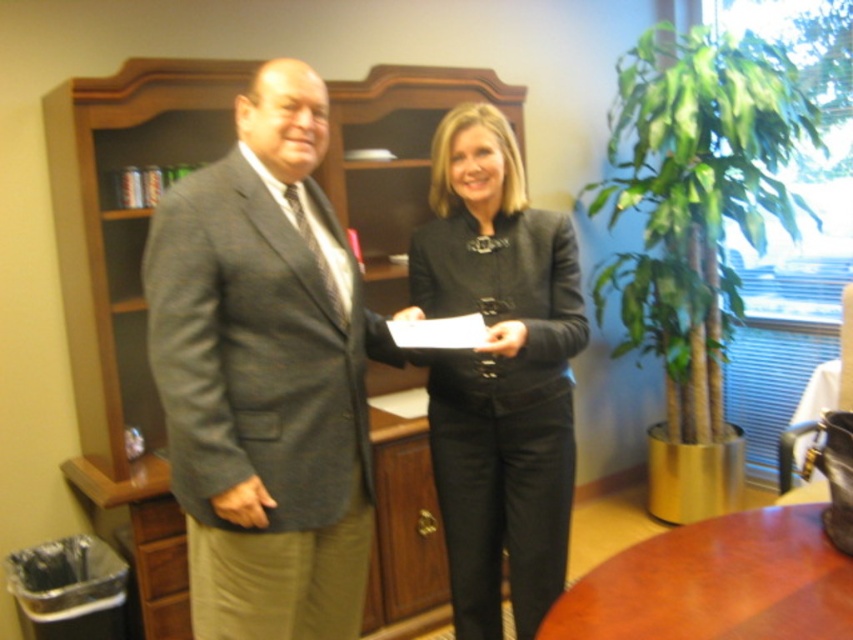
Consider the image. Does gray wool suit at center have a smaller size compared to brown wooden table at center?

Incorrect, gray wool suit at center is not smaller in size than brown wooden table at center.

I want to click on gray wool suit at center, so click(265, 374).

Can you confirm if gray wool suit at center is wider than black matte blazer at center?

Correct, the width of gray wool suit at center exceeds that of black matte blazer at center.

Is gray wool suit at center further to camera compared to black matte blazer at center?

No.

Between point (317, 368) and point (540, 593), which one is positioned behind?

Positioned behind is point (540, 593).

Locate an element on the screen. gray wool suit at center is located at coordinates pyautogui.click(x=265, y=374).

Is black matte blazer at center wider than brown wooden table at center?

No.

Between point (428, 360) and point (763, 595), which one is positioned in front?

Positioned in front is point (763, 595).

Is point (416, 268) positioned after point (762, 624)?

Yes.

This screenshot has height=640, width=853. What are the coordinates of `black matte blazer at center` in the screenshot? It's located at (498, 372).